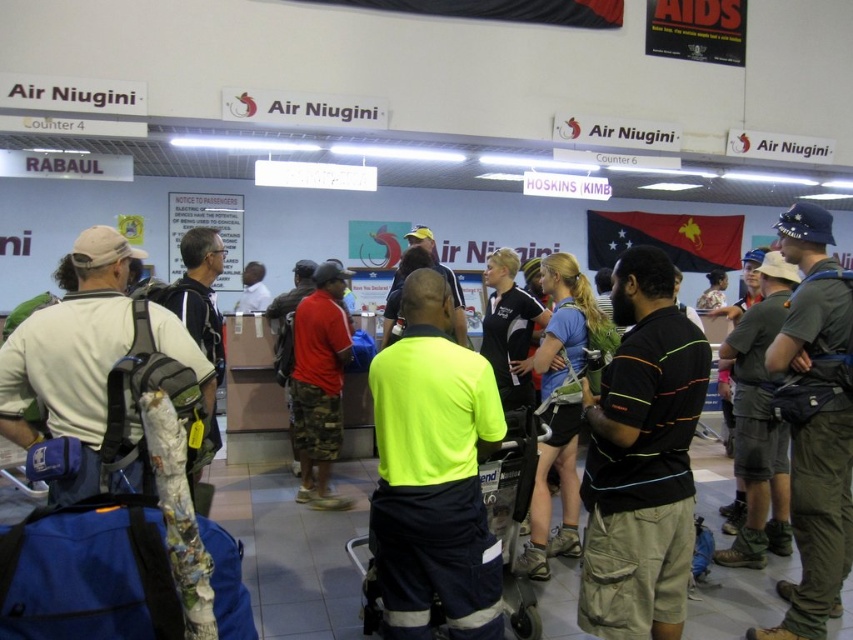
You are a traveler standing at the back of the line in the Air Niugini checkin area. You want to see the destination sign for RABAUL above the counter. The neon yellow shirt at center and the red cotton shirt at center are blocking your view. Which of the two shirts is shorter and thus less likely to block your view?

The neon yellow shirt at center has a lesser height compared to the red cotton shirt at center, so the neon yellow shirt at center is shorter and less likely to block your view.

You are a passenger at the airport checkin area. You see a staff member in a neon yellow shirt at center and a traveler in a red cotton shirt at center. Which shirt is positioned more to the east side of the scene?

The neon yellow shirt at center is to the right of red cotton shirt at center, so the neon yellow shirt at center is positioned more to the east side of the scene.

You are a traveler standing at the entrance of the Air Niugini checkin area. You see a neon yellow shirt at center and a red cotton shirt at center. Which shirt is closer to the floor?

The neon yellow shirt at center is located below red cotton shirt at center, so the neon yellow shirt at center is closer to the floor.